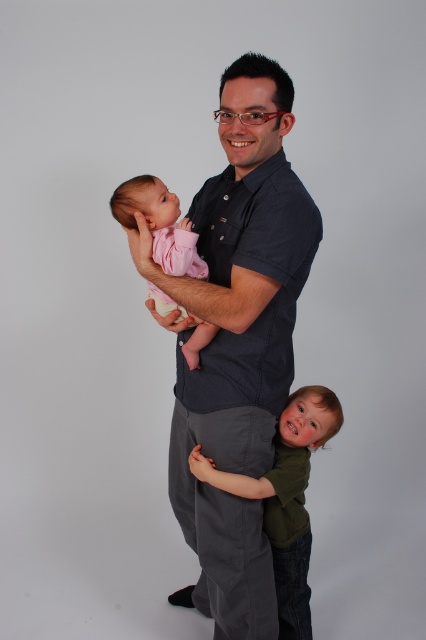
Who is higher up, dark blue shirt at center or pink soft fabric baby at left?

Positioned higher is pink soft fabric baby at left.

This screenshot has height=640, width=426. What do you see at coordinates (238, 340) in the screenshot?
I see `dark blue shirt at center` at bounding box center [238, 340].

Find the location of `dark blue shirt at center`. dark blue shirt at center is located at coordinates (238, 340).

Can you confirm if green matte shirt at lower right is smaller than pink soft fabric baby at left?

Actually, green matte shirt at lower right might be larger than pink soft fabric baby at left.

Can you confirm if green matte shirt at lower right is positioned below pink soft fabric baby at left?

Yes.

What do you see at coordinates (285, 497) in the screenshot?
I see `green matte shirt at lower right` at bounding box center [285, 497].

Find the location of `green matte shirt at lower right`. green matte shirt at lower right is located at coordinates click(x=285, y=497).

Does dark blue shirt at center lie behind green matte shirt at lower right?

No, it is in front of green matte shirt at lower right.

Which is more to the left, dark blue shirt at center or green matte shirt at lower right?

From the viewer's perspective, dark blue shirt at center appears more on the left side.

Is point (236, 176) behind point (290, 410)?

No, it is in front of (290, 410).

Find the location of a particular element. Image resolution: width=426 pixels, height=640 pixels. dark blue shirt at center is located at coordinates (238, 340).